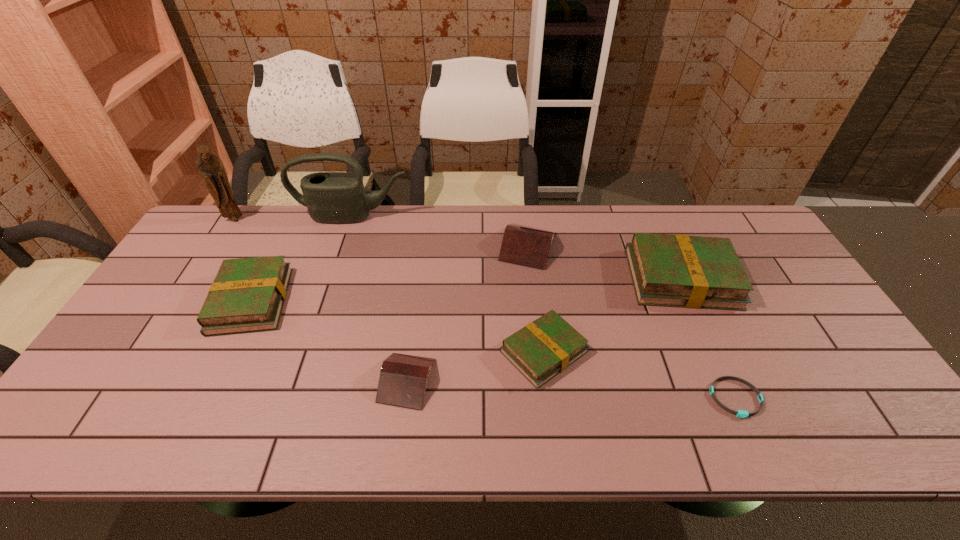
The width and height of the screenshot is (960, 540). I want to click on free space that satisfies the following two spatial constraints: 1. on the front side of the second book from left to right; 2. on the right side of the leftmost book, so click(x=212, y=381).

Identify the location of free space in the image that satisfies the following two spatial constraints: 1. on the spout of the second tallest object; 2. on the left side of the rightmost book. (332, 279).

At what (x,y) coordinates should I click in order to perform the action: click on blank area in the image that satisfies the following two spatial constraints: 1. on the front-facing side of the right brown book; 2. on the right side of the figurine. Please return your answer as a coordinate pair (x, y). Looking at the image, I should click on (218, 246).